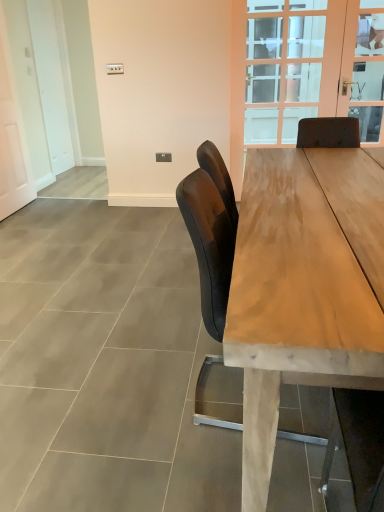
This screenshot has height=512, width=384. Describe the element at coordinates (311, 69) in the screenshot. I see `clear glass door at upper center` at that location.

What is the approximate height of matte black chair at center?

matte black chair at center is 93.10 centimeters tall.

The width and height of the screenshot is (384, 512). I want to click on clear glass door at upper right, so click(x=364, y=67).

What do you see at coordinates (12, 144) in the screenshot? This screenshot has height=512, width=384. I see `white matte door at left` at bounding box center [12, 144].

The height and width of the screenshot is (512, 384). Identify the location of clear glass door at upper center. (311, 69).

From a real-world perspective, is clear glass door at upper right beneath wooden table at center?

No.

Who is taller, clear glass door at upper right or wooden table at center?

clear glass door at upper right is taller.

From the image's perspective, does clear glass door at upper right appear higher than wooden table at center?

Yes, from the image's perspective, clear glass door at upper right is over wooden table at center.

Does clear glass door at upper right appear on the left side of wooden table at center?

In fact, clear glass door at upper right is to the right of wooden table at center.

I want to click on screen door below the clear glass door at upper right (from the image's perspective), so click(x=12, y=144).

How different are the orientations of white matte door at left and clear glass door at upper right in degrees?

There is a 92.3-degree angle between the facing directions of white matte door at left and clear glass door at upper right.

Is white matte door at left oriented towards clear glass door at upper right?

Yes, white matte door at left is aimed at clear glass door at upper right.

Based on the photo, considering the positions of objects white matte door at left and clear glass door at upper right in the image provided, who is more to the left, white matte door at left or clear glass door at upper right?

From the viewer's perspective, white matte door at left appears more on the left side.

Does matte black chair at center have a greater width compared to clear glass door at upper center?

Correct, the width of matte black chair at center exceeds that of clear glass door at upper center.

From a real-world perspective, is matte black chair at center below clear glass door at upper center?

Yes, from a real-world perspective, matte black chair at center is beneath clear glass door at upper center.

Which of these two, matte black chair at center or clear glass door at upper center, stands taller?

clear glass door at upper center.

Which is correct: matte black chair at center is inside clear glass door at upper center, or outside of it?

matte black chair at center exists outside the volume of clear glass door at upper center.

Would you say clear glass door at upper right contains matte black chair at center?

Definitely not — matte black chair at center is not inside clear glass door at upper right.

Considering the positions of objects clear glass door at upper right and matte black chair at center in the image provided, who is more to the right, clear glass door at upper right or matte black chair at center?

clear glass door at upper right.

Considering the sizes of objects clear glass door at upper right and matte black chair at center in the image provided, who is bigger, clear glass door at upper right or matte black chair at center?

Bigger between the two is matte black chair at center.

Considering the positions of points (358, 20) and (224, 314), is point (358, 20) farther from camera compared to point (224, 314)?

Yes, it is behind point (224, 314).

Is matte black chair at center further to camera compared to clear glass door at upper right?

No, matte black chair at center is closer to the viewer.

From the image's perspective, is matte black chair at center over clear glass door at upper right?

Actually, matte black chair at center appears below clear glass door at upper right in the image.

Considering the sizes of objects matte black chair at center and clear glass door at upper right in the image provided, who is taller, matte black chair at center or clear glass door at upper right?

Standing taller between the two is clear glass door at upper right.

Which is more to the right, matte black chair at center or clear glass door at upper right?

clear glass door at upper right is more to the right.

Do you think clear glass door at upper center is within white matte door at left, or outside of it?

clear glass door at upper center exists outside the volume of white matte door at left.

Can you confirm if clear glass door at upper center is positioned to the left of white matte door at left?

In fact, clear glass door at upper center is to the right of white matte door at left.

Would you say clear glass door at upper center is a long distance from white matte door at left?

clear glass door at upper center is positioned a significant distance from white matte door at left.

Can you tell me how much white matte door at left and matte black chair at center differ in facing direction?

The angular difference between white matte door at left and matte black chair at center is 1.34 degrees.

Could you tell me if white matte door at left is turned towards matte black chair at center?

No, white matte door at left is not facing towards matte black chair at center.

Does white matte door at left have a lesser width compared to matte black chair at center?

Yes, white matte door at left is thinner than matte black chair at center.

Does point (17, 193) appear closer or farther from the camera than point (228, 406)?

Point (17, 193).

Find the location of a particular element. table in front of the clear glass door at upper right is located at coordinates (303, 287).

At what (x,y) coordinates should I click in order to perform the action: click on screen door that is below the clear glass door at upper right (from the image's perspective). Please return your answer as a coordinate pair (x, y). Looking at the image, I should click on (12, 144).

Based on their spatial positions, is clear glass door at upper center or clear glass door at upper right closer to wooden table at center?

Among the two, clear glass door at upper right is located nearer to wooden table at center.

Which object lies further to the anchor point clear glass door at upper center, matte black chair at center or wooden table at center?

matte black chair at center.

Which object lies further to the anchor point white matte door at left, clear glass door at upper right or clear glass door at upper center?

Based on the image, clear glass door at upper right appears to be further to white matte door at left.

From the image, which object appears to be nearer to clear glass door at upper right, matte black chair at center or wooden table at center?

Based on the image, wooden table at center appears to be nearer to clear glass door at upper right.

When comparing their distances from clear glass door at upper center, does clear glass door at upper right or wooden table at center seem further?

The object further to clear glass door at upper center is wooden table at center.

When comparing their distances from clear glass door at upper right, does wooden table at center or white matte door at left seem further?

white matte door at left lies further to clear glass door at upper right than the other object.

Looking at the image, which one is located closer to white matte door at left, clear glass door at upper center or wooden table at center?

Among the two, clear glass door at upper center is located nearer to white matte door at left.

Which object lies further to the anchor point clear glass door at upper right, clear glass door at upper center or wooden table at center?

Based on the image, wooden table at center appears to be further to clear glass door at upper right.

At what (x,y) coordinates should I click in order to perform the action: click on chair between white matte door at left and clear glass door at upper right from left to right. Please return your answer as a coordinate pair (x, y). The image size is (384, 512). Looking at the image, I should click on (209, 245).

You are a GUI agent. You are given a task and a screenshot of the screen. Output one action in this format:
    pyautogui.click(x=<x>, y=<y>)
    Task: Click on the window screen between matte black chair at center and clear glass door at upper center along the z-axis
    
    Given the screenshot: What is the action you would take?
    pyautogui.click(x=364, y=67)

Locate an element on the screen. The width and height of the screenshot is (384, 512). window screen positioned between wooden table at center and clear glass door at upper center from near to far is located at coordinates (364, 67).

You are a GUI agent. You are given a task and a screenshot of the screen. Output one action in this format:
    pyautogui.click(x=<x>, y=<y>)
    Task: Click on the chair between wooden table at center and clear glass door at upper right in the front-back direction
    Image resolution: width=384 pixels, height=512 pixels.
    Given the screenshot: What is the action you would take?
    pyautogui.click(x=209, y=245)